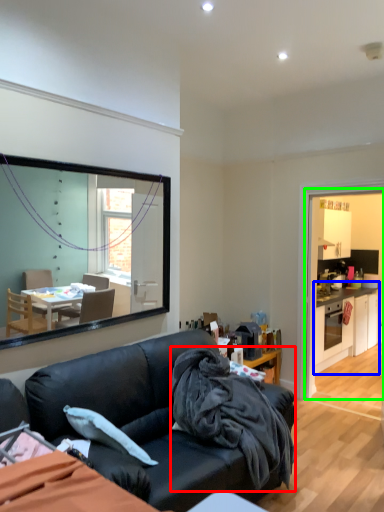
Question: Which is nearer to the blanket (highlighted by a red box)? cabinetry (highlighted by a blue box) or dresser (highlighted by a green box).

Choices:
 (A) cabinetry
 (B) dresser

Answer: (A)